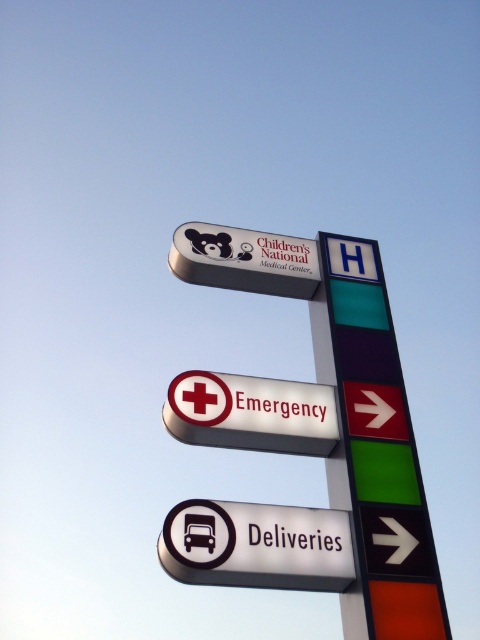
You are standing in front of the Children National Medical Center signpost. You see a white plastic sign at lower center and a white plastic emergency sign at center. Which one is positioned to the left of the other?

The white plastic sign at lower center is to the left of the white plastic emergency sign at center.

You are standing in front of the Children National Medical Center signpost and need to find the emergency entrance. You see a white plastic sign at lower center and a green plastic pole at center. Which object takes up more space visually?

The green plastic pole at center takes up more space visually than the white plastic sign at lower center because the white plastic sign at lower center occupies less space than green plastic pole at center.